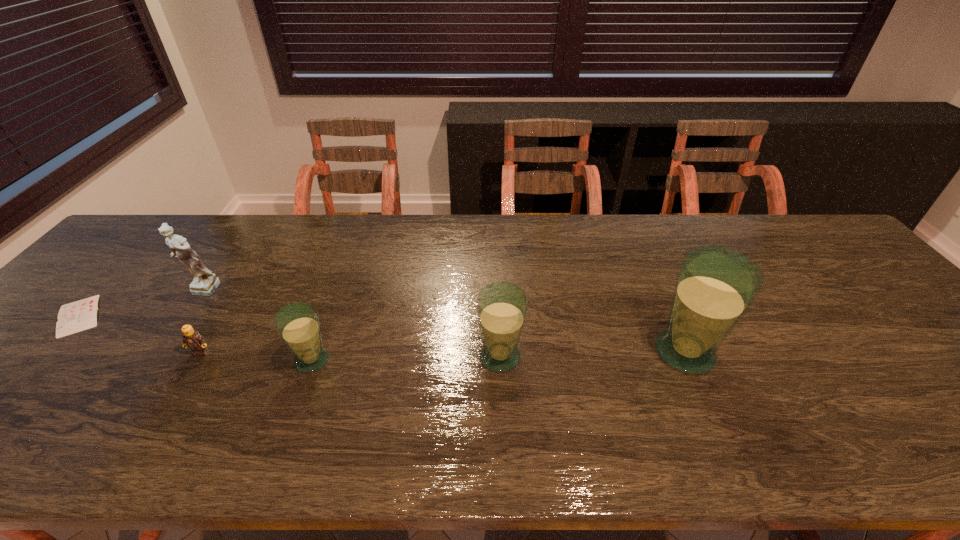
Please point a spot to add another glass on the right. Please provide its 2D coordinates. Your answer should be formatted as a tuple, i.e. [(x, y)], where the tuple contains the x and y coordinates of a point satisfying the conditions above.

[(867, 349)]